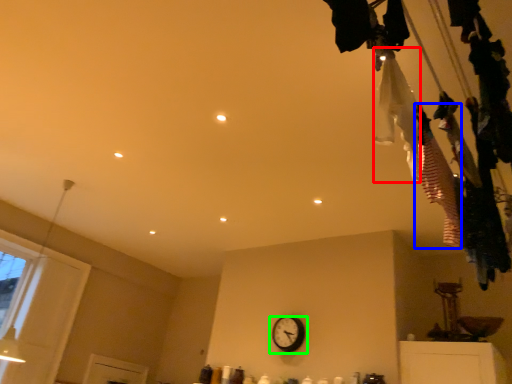
Question: Based on their relative distances, which object is farther from clothing (highlighted by a red box)? Choose from clothing (highlighted by a blue box) and wall clock (highlighted by a green box).

Choices:
 (A) clothing
 (B) wall clock

Answer: (B)